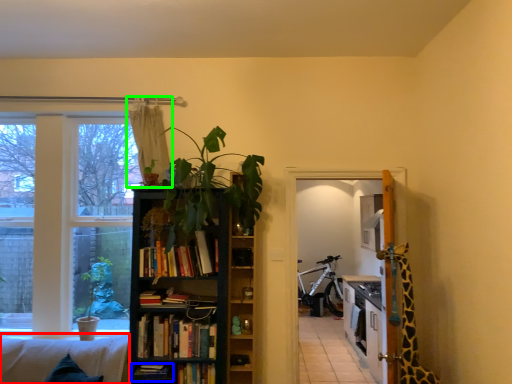
Question: Which object is the farthest from couch (highlighted by a red box)? Choose among these: book (highlighted by a blue box) or curtain (highlighted by a green box).

Choices:
 (A) book
 (B) curtain

Answer: (B)